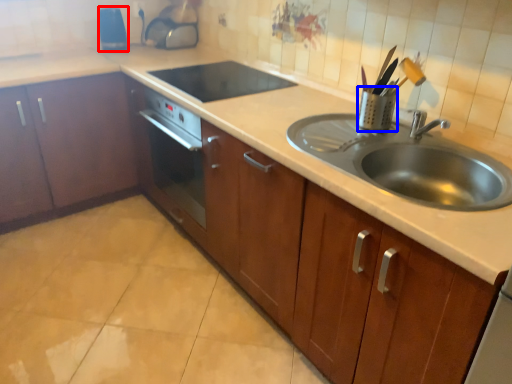
Question: Among these objects, which one is farthest to the camera, appliance (highlighted by a red box) or appliance (highlighted by a blue box)?

Choices:
 (A) appliance
 (B) appliance

Answer: (A)